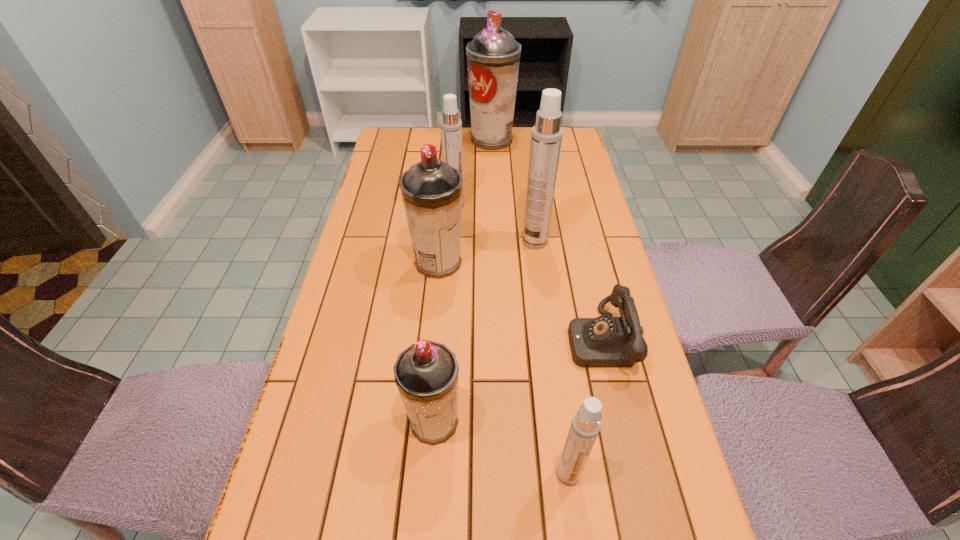
At what (x,y) coordinates should I click in order to perform the action: click on vacant space situated 0.260m on the dial of the telephone. Please return your answer as a coordinate pair (x, y). Image resolution: width=960 pixels, height=540 pixels. Looking at the image, I should click on (461, 340).

The image size is (960, 540). I want to click on object situated at the far edge, so click(493, 56).

Locate an element on the screen. The height and width of the screenshot is (540, 960). object that is at the right edge is located at coordinates (606, 341).

Locate an element on the screen. The height and width of the screenshot is (540, 960). free point at the left edge is located at coordinates (361, 212).

In the image, there is a desktop. Where is `vacant space at the right edge`? The width and height of the screenshot is (960, 540). vacant space at the right edge is located at coordinates (653, 396).

What are the coordinates of `free space at the far left corner` in the screenshot? It's located at (403, 136).

Identify the location of free space between the telephone and the biggest white aerosol can. (x=567, y=291).

Locate an element on the screen. empty location between the biggest white aerosol can and the fifth nearest aerosol can is located at coordinates (495, 223).

Find the location of `vacant space in between the nearest white aerosol can and the second biggest gray aerosol can`. vacant space in between the nearest white aerosol can and the second biggest gray aerosol can is located at coordinates (503, 368).

Identify the location of free space that is in between the fifth nearest aerosol can and the nearest gray aerosol can. The image size is (960, 540). (444, 314).